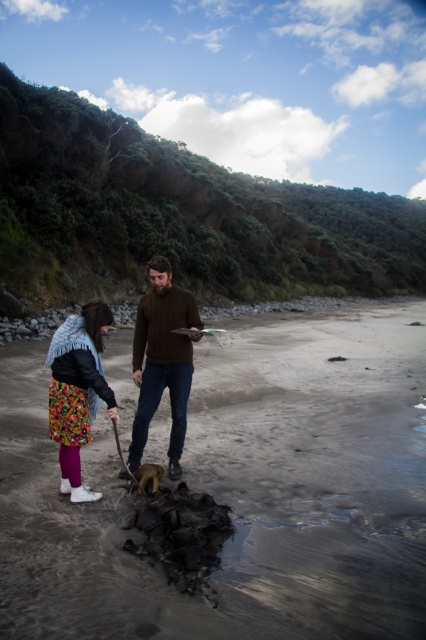
Measure the distance between point (31,477) and camera.

The distance of point (31,477) from camera is 16.69 feet.

Who is more forward, (250, 380) or (83, 348)?

Point (83, 348)

Is point (19, 374) closer to viewer compared to point (88, 314)?

No, (19, 374) is behind (88, 314).

Where is `dark sand at center`? The image size is (426, 640). dark sand at center is located at coordinates (239, 492).

From the picture: Is dark sand at center wider than brown knitted sweater at center?

Yes.

Can you confirm if dark sand at center is smaller than brown knitted sweater at center?

Actually, dark sand at center might be larger than brown knitted sweater at center.

Where is `dark sand at center`? This screenshot has height=640, width=426. dark sand at center is located at coordinates (239, 492).

At what (x,y) coordinates should I click in order to perform the action: click on dark sand at center. Please return your answer as a coordinate pair (x, y). This screenshot has width=426, height=640. Looking at the image, I should click on (239, 492).

Is brown knitted sweater at center smaller than floral-patterned skirt at lower left?

Correct, brown knitted sweater at center occupies less space than floral-patterned skirt at lower left.

Is brown knitted sweater at center wider than floral-patterned skirt at lower left?

No.

Between point (135, 454) and point (92, 324), which one is positioned behind?

Point (135, 454)

This screenshot has height=640, width=426. Identify the location of brown knitted sweater at center. (163, 358).